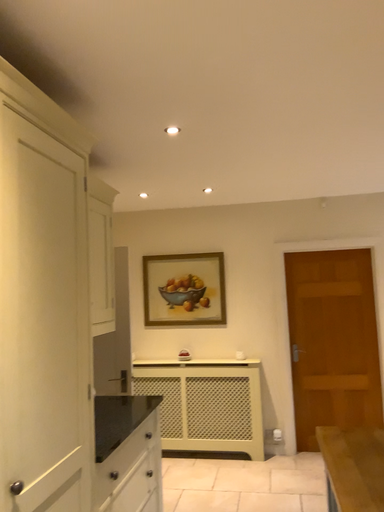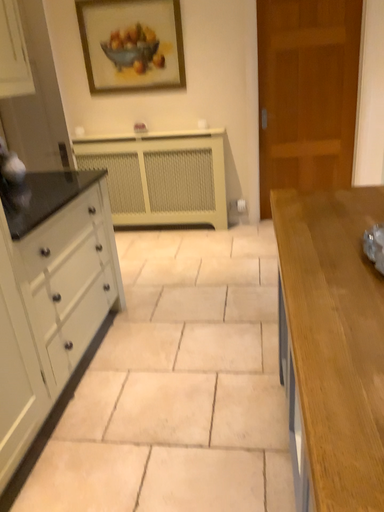
Question: Which way did the camera rotate in the video?

Choices:
 (A) rotated upward
 (B) rotated downward

Answer: (B)